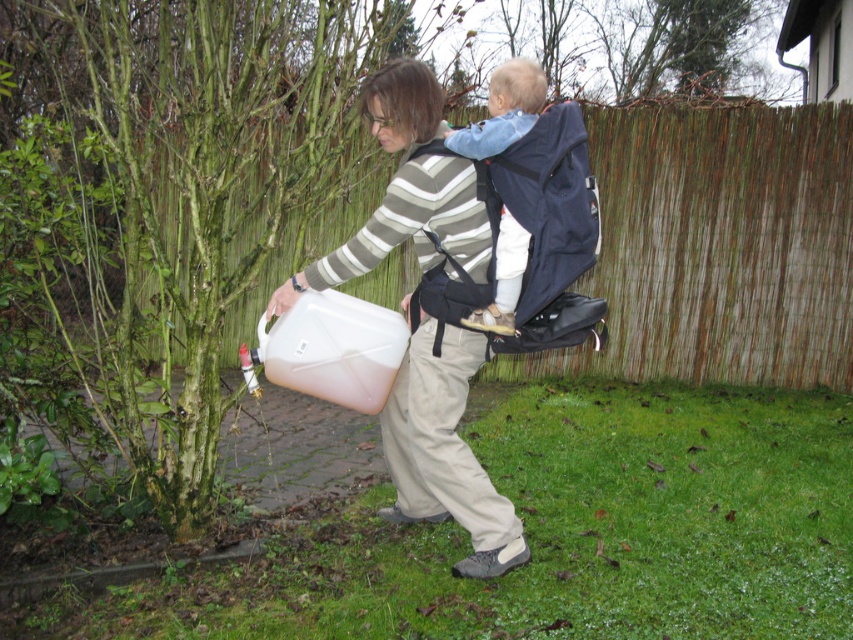
Question: Does matte plastic container at center appear under blue fabric carrier at center?

Choices:
 (A) no
 (B) yes

Answer: (B)

Question: Which point is closer to the camera?

Choices:
 (A) brown woven fence at upper center
 (B) matte plastic container at center

Answer: (B)

Question: Which point is closer to the camera?

Choices:
 (A) (514, 275)
 (B) (660, 212)

Answer: (A)

Question: Estimate the real-world distances between objects in this image. Which object is farther from the brown woven fence at upper center?

Choices:
 (A) blue fabric carrier at center
 (B) matte plastic container at center

Answer: (A)

Question: Can you confirm if brown woven fence at upper center is positioned below matte plastic container at center?

Choices:
 (A) yes
 (B) no

Answer: (B)

Question: Is brown woven fence at upper center in front of blue fabric carrier at center?

Choices:
 (A) yes
 (B) no

Answer: (B)